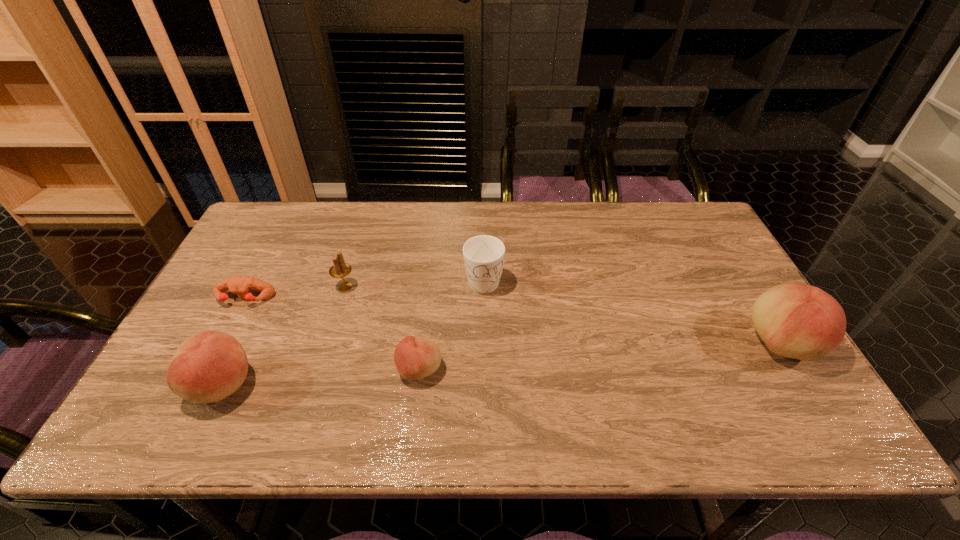
If equal spacing is desired by inserting an extra peach among them, please point out a free spot for this new peach. Please provide its 2D coordinates. Your answer should be formatted as a tuple, i.e. [(x, y)], where the tuple contains the x and y coordinates of a point satisfying the conditions above.

[(605, 356)]